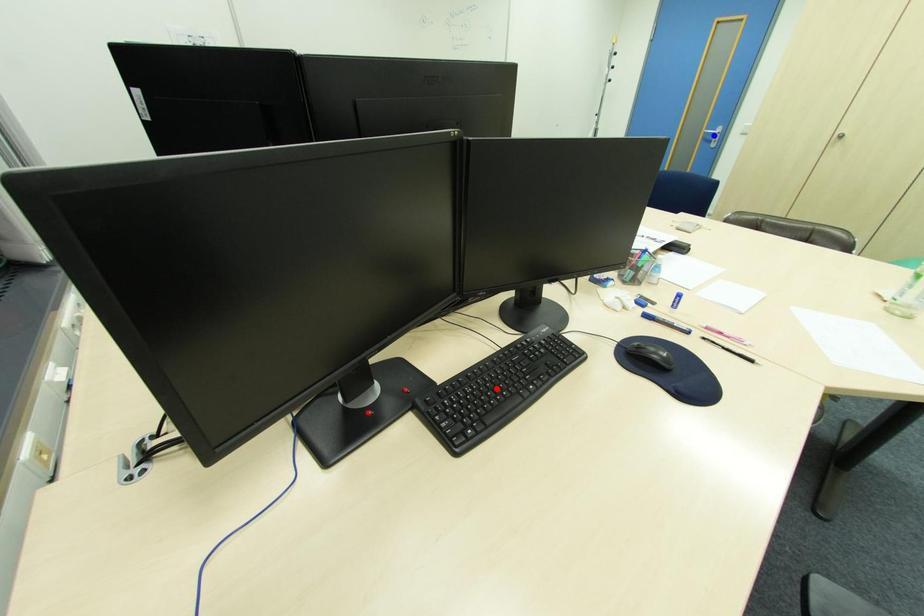
Question: Which of the two points in the image is closer to the camera?

Choices:
 (A) Blue point is closer.
 (B) Red point is closer.

Answer: (B)